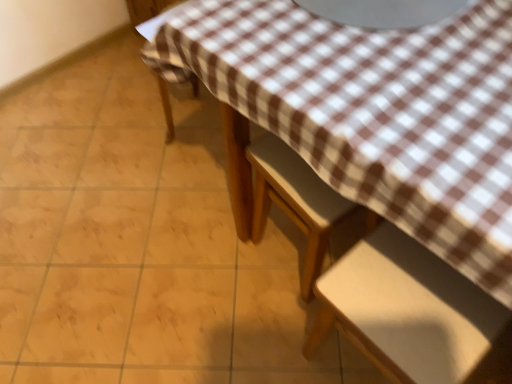
Question: From a real-world perspective, does brown checkered tablecloth at upper center stand above wooden chair at center, placed as the second chair when sorted from top to bottom?

Choices:
 (A) no
 (B) yes

Answer: (A)

Question: From the image's perspective, is brown checkered tablecloth at upper center located beneath wooden chair at center, which is the second chair in bottom-to-top order?

Choices:
 (A) no
 (B) yes

Answer: (B)

Question: Does brown checkered tablecloth at upper center lie behind wooden chair at center, which is the second chair in bottom-to-top order?

Choices:
 (A) no
 (B) yes

Answer: (A)

Question: Is brown checkered tablecloth at upper center positioned far away from wooden chair at center, which is the second chair in bottom-to-top order?

Choices:
 (A) yes
 (B) no

Answer: (B)

Question: Considering the relative sizes of brown checkered tablecloth at upper center and wooden chair at center, placed as the second chair when sorted from top to bottom, in the image provided, is brown checkered tablecloth at upper center taller than wooden chair at center, placed as the second chair when sorted from top to bottom,?

Choices:
 (A) yes
 (B) no

Answer: (B)

Question: From the image's perspective, is white matte chair at lower right, the first chair in the bottom-to-top sequence, located above or below brown checkered fabric at lower left, which appears as the third chair when ordered from the bottom?

Choices:
 (A) above
 (B) below

Answer: (B)

Question: Visually, is white matte chair at lower right, marked as the 3th chair in a top-to-bottom arrangement, positioned to the left or to the right of brown checkered fabric at lower left, which is the first chair in top-to-bottom order?

Choices:
 (A) left
 (B) right

Answer: (B)

Question: From a real-world perspective, relative to brown checkered fabric at lower left, which appears as the third chair when ordered from the bottom, is white matte chair at lower right, marked as the 3th chair in a top-to-bottom arrangement, vertically above or below?

Choices:
 (A) below
 (B) above

Answer: (B)

Question: Considering the positions of white matte chair at lower right, marked as the 3th chair in a top-to-bottom arrangement, and brown checkered fabric at lower left, which is the first chair in top-to-bottom order, in the image, is white matte chair at lower right, marked as the 3th chair in a top-to-bottom arrangement, taller or shorter than brown checkered fabric at lower left, which is the first chair in top-to-bottom order,?

Choices:
 (A) short
 (B) tall

Answer: (B)

Question: In the image, is white matte chair at lower right, the first chair in the bottom-to-top sequence, on the left side or the right side of wooden chair at center, placed as the second chair when sorted from top to bottom?

Choices:
 (A) left
 (B) right

Answer: (B)

Question: From the image's perspective, is white matte chair at lower right, marked as the 3th chair in a top-to-bottom arrangement, located above or below wooden chair at center, placed as the second chair when sorted from top to bottom?

Choices:
 (A) above
 (B) below

Answer: (B)

Question: In terms of height, does white matte chair at lower right, the first chair in the bottom-to-top sequence, look taller or shorter compared to wooden chair at center, placed as the second chair when sorted from top to bottom?

Choices:
 (A) tall
 (B) short

Answer: (B)

Question: Considering the positions of point (338, 321) and point (315, 266), is point (338, 321) closer or farther from the camera than point (315, 266)?

Choices:
 (A) farther
 (B) closer

Answer: (B)

Question: In the image, is brown checkered tablecloth at upper center positioned in front of or behind wooden chair at center, which is the second chair in bottom-to-top order?

Choices:
 (A) front
 (B) behind

Answer: (A)

Question: Would you say brown checkered tablecloth at upper center is to the left or to the right of wooden chair at center, which is the second chair in bottom-to-top order, in the picture?

Choices:
 (A) left
 (B) right

Answer: (A)